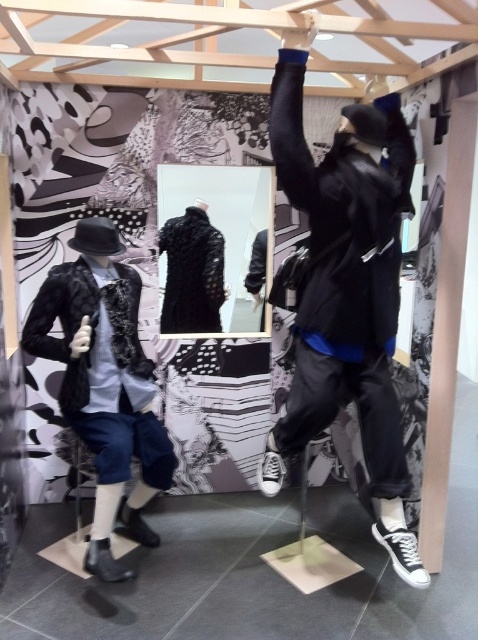
You are a store employee who needs to arrange the two matte black jackets so that they are exactly 36 inches apart. Currently, the distance between the matte black jacket at upper right and the matte black jacket at left is 37.01 inches. Do you need to move the jackets closer together or farther apart to achieve the desired distance?

The current distance between the matte black jacket at upper right and the matte black jacket at left is 37.01 inches. To reach the desired 36 inches, you need to move them closer together by approximately 1.01 inches.

You are an assistant helping to organize the display. You need to place a wide decorative banner between the matte black jacket at upper right and the matte black jacket at left. Which jacket requires more space on the banner due to its width?

The matte black jacket at upper right requires more space on the banner because it might be wider than the matte black jacket at left.